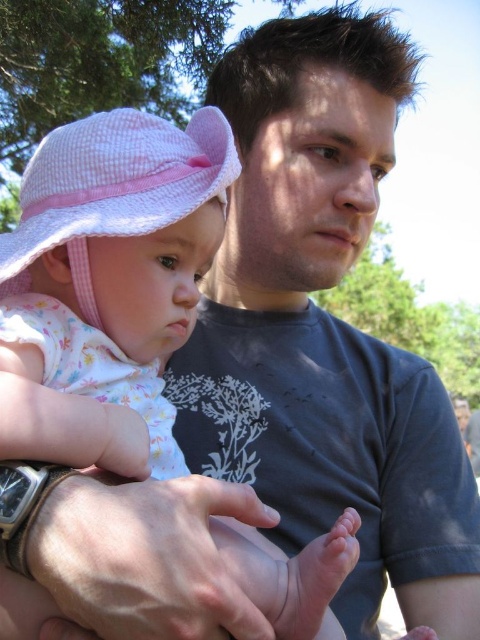
Question: Is pink gingham hat at upper left in front of pink seersucker hat at left?

Choices:
 (A) yes
 (B) no

Answer: (A)

Question: Which object appears closest to the camera in this image?

Choices:
 (A) pink seersucker hat at left
 (B) pink gingham hat at upper left

Answer: (B)

Question: Is pink gingham hat at upper left smaller than pink seersucker hat at left?

Choices:
 (A) no
 (B) yes

Answer: (A)

Question: Which of the following is the farthest from the observer?

Choices:
 (A) pink seersucker hat at left
 (B) pink gingham hat at upper left

Answer: (A)

Question: Observing the image, what is the correct spatial positioning of pink gingham hat at upper left in reference to pink seersucker hat at left?

Choices:
 (A) left
 (B) right

Answer: (B)